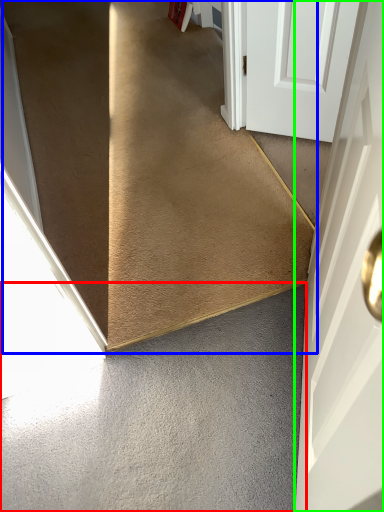
Question: Based on their relative distances, which object is farther from concrete (highlighted by a red box)? Choose from stairs (highlighted by a blue box) and door (highlighted by a green box).

Choices:
 (A) stairs
 (B) door

Answer: (A)